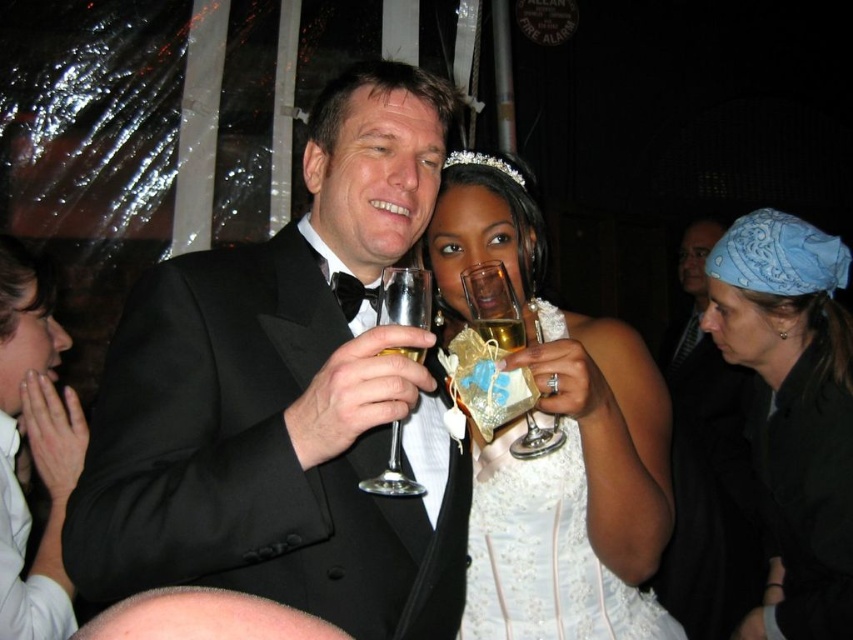
You are a photographer at the wedding reception. You need to capture a photo where both the blue bandana at upper right and the gold metallic champagne glass at center are clearly visible. Considering their sizes, which object might appear larger in the final photo?

The blue bandana at upper right is much taller than the gold metallic champagne glass at center, so it will appear larger in the photo.

You are a photographer at the wedding reception and need to adjust your focus. You have two points to consider, point (x=566, y=616) and point (x=373, y=484). Which point should you focus on first if you want to capture the closest object in the scene?

Point (x=566, y=616) should be focused on first because it is closer to the viewer than point (x=373, y=484) according to the spatial description.

You are a photographer at the wedding reception and need to adjust the lighting to highlight the bride in her white lace dress at center. Given the current dimly lit environment, where should you position the spotlight relative to the bride to ensure optimal illumination?

The white lace dress at center is located at point 0.867 on the x axis and 0.639 on the y axis. To optimally illuminate the bride, position the spotlight directly above or slightly to the side of these coordinates to ensure even lighting without casting harsh shadows.